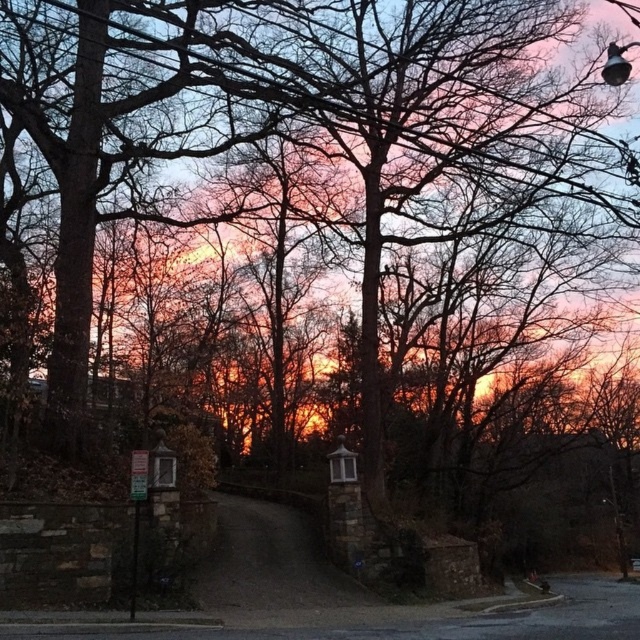
You are standing on the paved pathway and see two points marked in the scene. Which point is closer to you, point (131, 481) or point (136, 566)?

Point (131, 481) is in front of point (136, 566), so it is closer to you.

You are standing at the center of the paved pathway bordered by low stone walls. You need to locate the green plastic sign at lower left. Based on the coordinates provided, in which direction should you look to find it?

The green plastic sign at lower left is located at point coordinates of (138, 474), so you should look to your lower left direction to find it.

You are standing at the point marked as point (129, 490) in the image. The signpost is on the left side of the path. Can you see the signpost from your current position?

Yes, because the distance between you and the point (129, 490) is 12.06 meters, so you can see the signpost on the left side of the path from your current position.